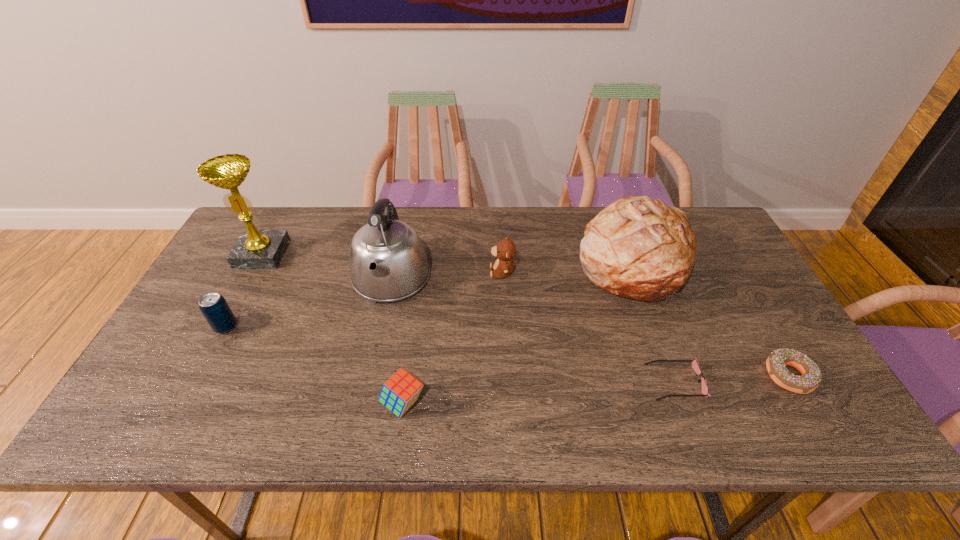
Find the location of a particular element. The image size is (960, 540). blank region between the sixth shortest object and the soda can is located at coordinates (429, 295).

The width and height of the screenshot is (960, 540). I want to click on free space between the fifth farthest object and the bread, so click(x=429, y=295).

You are a GUI agent. You are given a task and a screenshot of the screen. Output one action in this format:
    pyautogui.click(x=<x>, y=<y>)
    Task: Click on the free space between the fourth object from right to left and the sunglasses
    This screenshot has width=960, height=540.
    Given the screenshot: What is the action you would take?
    pyautogui.click(x=588, y=327)

You are a GUI agent. You are given a task and a screenshot of the screen. Output one action in this format:
    pyautogui.click(x=<x>, y=<y>)
    Task: Click on the free space between the third shortest object and the tallest object
    This screenshot has height=540, width=960.
    Given the screenshot: What is the action you would take?
    pyautogui.click(x=333, y=329)

Identify the location of empty space that is in between the award and the fifth farthest object. (244, 291).

The width and height of the screenshot is (960, 540). I want to click on vacant space in between the sixth shortest object and the sunglasses, so click(x=654, y=323).

Find the location of a particular element. Image resolution: width=960 pixels, height=540 pixels. free spot between the cube and the bread is located at coordinates (517, 334).

Where is `object identified as the closest to the teddy bear`? object identified as the closest to the teddy bear is located at coordinates (387, 260).

Identify which object is the third closest to the award. Please provide its 2D coordinates. Your answer should be formatted as a tuple, i.e. [(x, y)], where the tuple contains the x and y coordinates of a point satisfying the conditions above.

[(401, 391)]

Find the location of a particular element. The image size is (960, 540). vacant space that satisfies the following two spatial constraints: 1. on the face of the fourth object from right to left; 2. on the spout of the second tallest object is located at coordinates (502, 278).